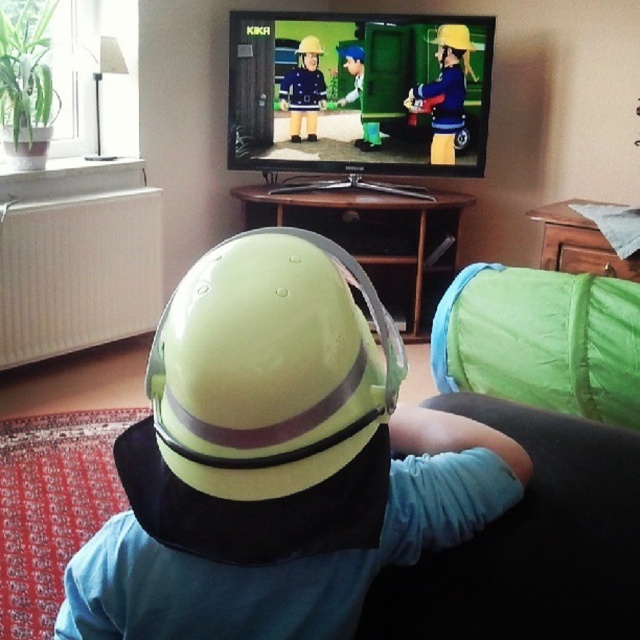
Between green fabric at lower right and yellow matte helmet at upper center, which one is positioned higher?

yellow matte helmet at upper center is higher up.

Who is more forward, (435,349) or (413,90)?

Point (435,349)

The height and width of the screenshot is (640, 640). What do you see at coordinates (541, 340) in the screenshot?
I see `green fabric at lower right` at bounding box center [541, 340].

Where is `green fabric at lower right`? The height and width of the screenshot is (640, 640). green fabric at lower right is located at coordinates (541, 340).

Does glossy yellow helmet at center have a lesser width compared to matte blue uniform at center?

Incorrect, glossy yellow helmet at center's width is not less than matte blue uniform at center's.

Does point (316, 308) come behind point (324, 88)?

That is False.

In order to click on glossy yellow helmet at center in this screenshot , I will do `click(264, 404)`.

Can you confirm if blue fabric at lower right is positioned below blue fabric hat at center?

Correct, blue fabric at lower right is located below blue fabric hat at center.

Which is behind, point (504, 579) or point (358, 48)?

The point (358, 48) is behind.

Which is in front, point (504, 564) or point (358, 48)?

Point (504, 564) is more forward.

I want to click on blue fabric at lower right, so click(531, 545).